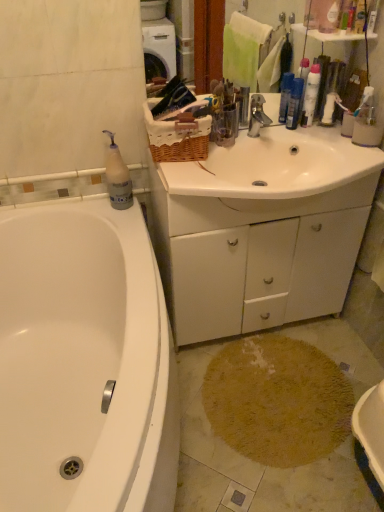
Question: Which is correct: beige shaggy rug at lower center is inside white matte cabinet at center, or outside of it?

Choices:
 (A) outside
 (B) inside

Answer: (A)

Question: Is point (266, 358) closer or farther from the camera than point (321, 285)?

Choices:
 (A) closer
 (B) farther

Answer: (A)

Question: Which object is positioned closest to the beige shaggy rug at lower center?

Choices:
 (A) white glossy bathtub at lower left
 (B) white glossy sink at center
 (C) pink plastic bottle at upper right, the 1th toiletry in the right-to-left sequence
 (D) metallic silver faucet at center
 (E) blue plastic bottles at upper right, the 2th toiletry when ordered from front to back

Answer: (A)

Question: Which of these objects is positioned closest to the translucent plastic bottle at upper left, arranged as the 1th cleaning product when ordered from the bottom?

Choices:
 (A) pink plastic bottle at upper right, the first toiletry viewed from the front
 (B) blue plastic spray bottle at upper right, which is the second cleaning product in left-to-right order
 (C) white glossy sink at center
 (D) white matte cabinet at center
 (E) white glossy bathtub at lower left

Answer: (E)